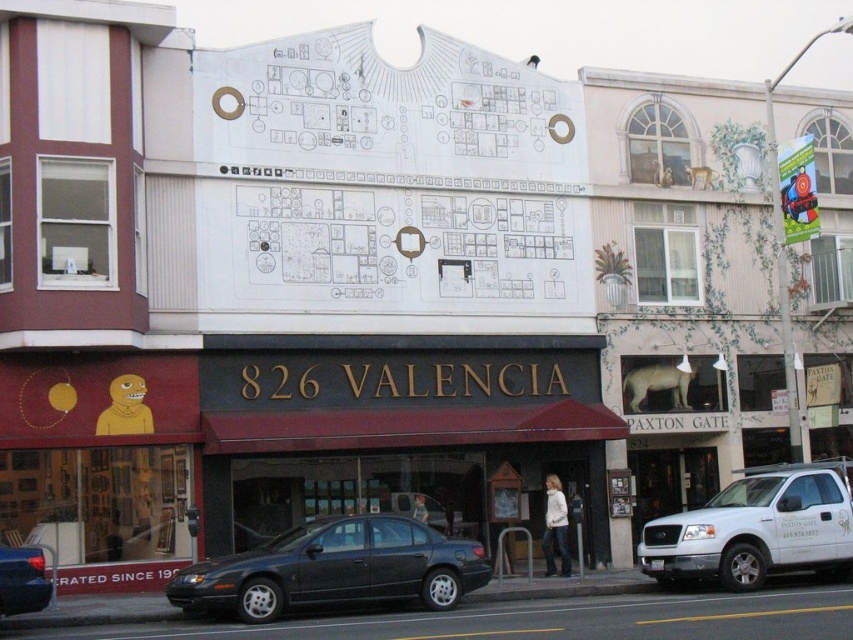
Based on the photo, you are a pedestrian standing on the sidewalk in front of the 826 Valencia storefront. You need to cross the street to reach the building with the mural. There is a matte black sedan at center and a white matte truck at lower right. Which vehicle should you avoid stepping on to safely cross between them?

The matte black sedan at center is located below the white matte truck at lower right. To safely cross between them, you should avoid stepping on the matte black sedan at center, as it is positioned lower and closer to the sidewalk, making it the closer obstacle to navigate around.

You are driving a matte black sedan at center and want to park it in a parking spot that can only accommodate vehicles shorter than the white matte truck at lower right. Can your vehicle fit?

The matte black sedan at center is shorter than the white matte truck at lower right, so it can fit in the parking spot designed for vehicles shorter than the white matte truck at lower right.

You are standing on the street looking at the building with the white mural. There is a point marked at coordinates (334, 568). What object is located at that point?

The point at coordinates (334, 568) corresponds to a matte black sedan at center.